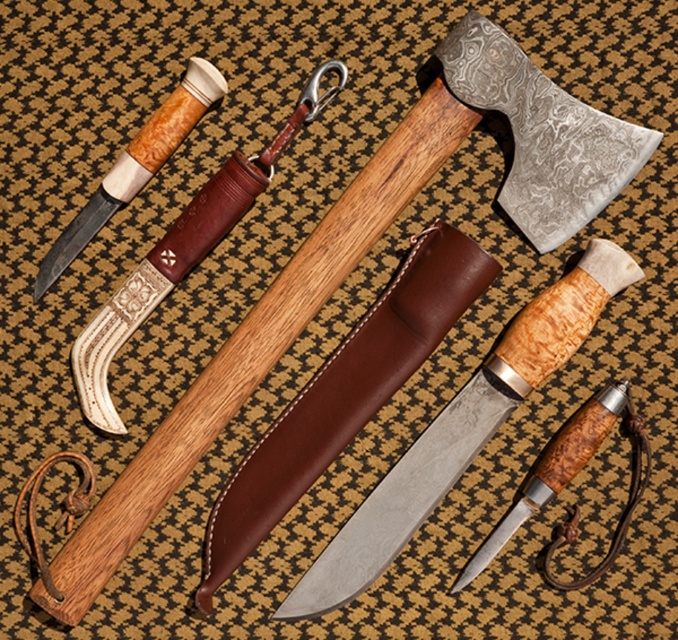
You are a customer in a knife shop and want to buy the matte silver knife at center and the matte brown wooden dagger at center. The shopkeeper tells you that the dagger is above the knife. Is this true?

Yes, the matte brown wooden dagger at center is above the matte silver knife at center because the matte silver knife at center is positioned under it.

You are standing in front of the knife display and want to pick up the knife at point [443,412]. Is it obscured by the item at point [144,310]?

Point [443,412] is behind point [144,310], so the knife at point [443,412] is obscured by the item at point [144,310].